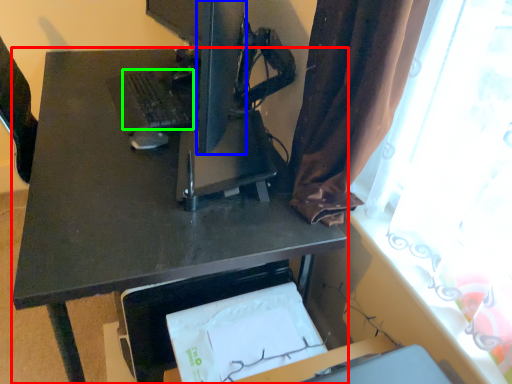
Question: Which object is the farthest from desk (highlighted by a red box)? Choose among these: computer monitor (highlighted by a blue box) or laptop keyboard (highlighted by a green box).

Choices:
 (A) computer monitor
 (B) laptop keyboard

Answer: (A)